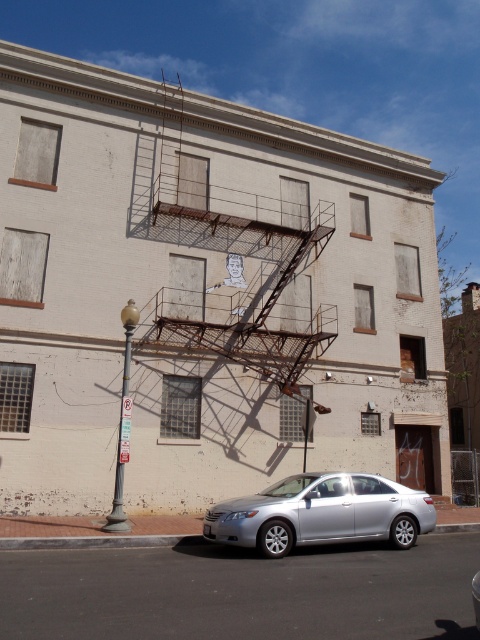
Question: Which object is the farthest from the rusty metal fire escape at center?

Choices:
 (A) silver metallic sedan at lower center
 (B) metallic streetlamp at left

Answer: (A)

Question: Which object appears farthest from the camera in this image?

Choices:
 (A) silver metallic sedan at lower center
 (B) metallic streetlamp at left

Answer: (B)

Question: Which object is positioned closest to the silver metallic sedan at lower center?

Choices:
 (A) metallic streetlamp at left
 (B) rusty metal fire escape at center

Answer: (A)

Question: Is rusty metal fire escape at center closer to the viewer compared to metallic streetlamp at left?

Choices:
 (A) yes
 (B) no

Answer: (B)

Question: Is silver metallic sedan at lower center below metallic streetlamp at left?

Choices:
 (A) no
 (B) yes

Answer: (B)

Question: Does rusty metal fire escape at center have a larger size compared to metallic streetlamp at left?

Choices:
 (A) no
 (B) yes

Answer: (B)